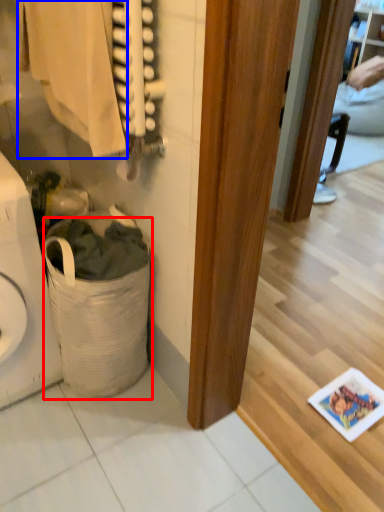
Question: Which object appears closest to the camera in this image, laundry basket (highlighted by a red box) or clothing (highlighted by a blue box)?

Choices:
 (A) laundry basket
 (B) clothing

Answer: (B)